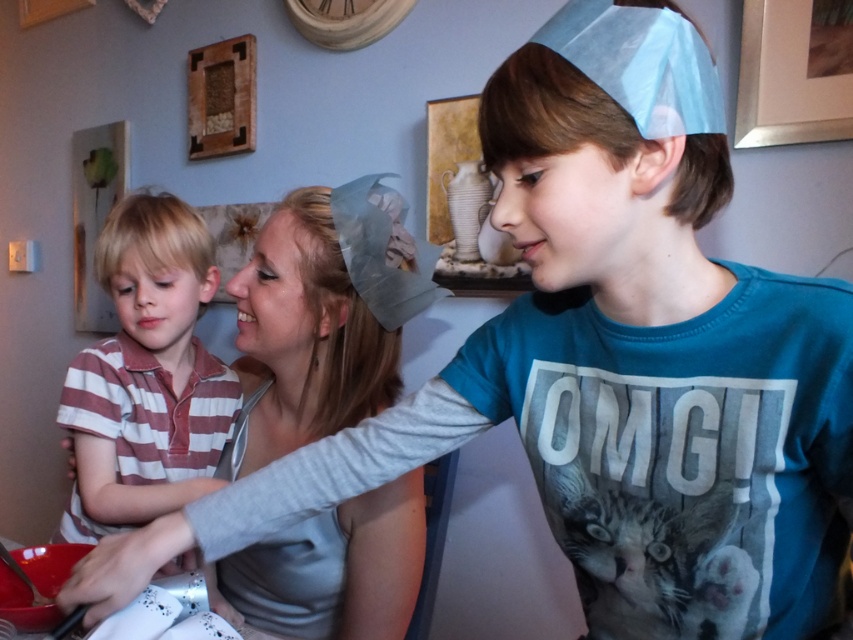
Does gray fabric headband at upper center appear over striped cotton shirt at left?

No, gray fabric headband at upper center is not above striped cotton shirt at left.

Can you confirm if gray fabric headband at upper center is taller than striped cotton shirt at left?

Yes, gray fabric headband at upper center is taller than striped cotton shirt at left.

Who is more distant from viewer, (x=283, y=259) or (x=198, y=305)?

The point (x=198, y=305) is behind.

You are a GUI agent. You are given a task and a screenshot of the screen. Output one action in this format:
    pyautogui.click(x=<x>, y=<y>)
    Task: Click on the gray fabric headband at upper center
    
    Given the screenshot: What is the action you would take?
    point(305,336)